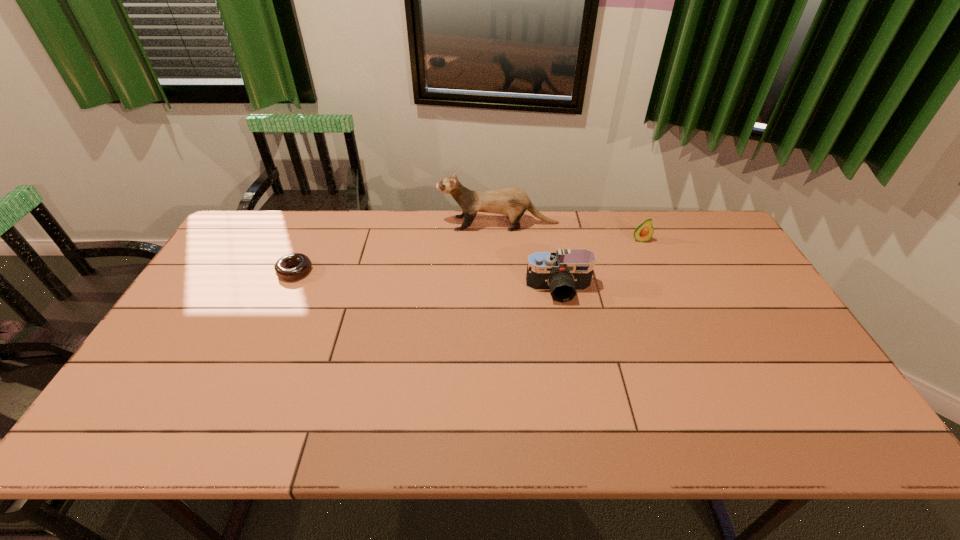
Locate an element on the screen. The image size is (960, 540). object that is the third closest to the second tallest object is located at coordinates tap(303, 263).

Where is `object that stands as the closest to the ferret`? object that stands as the closest to the ferret is located at coordinates (563, 272).